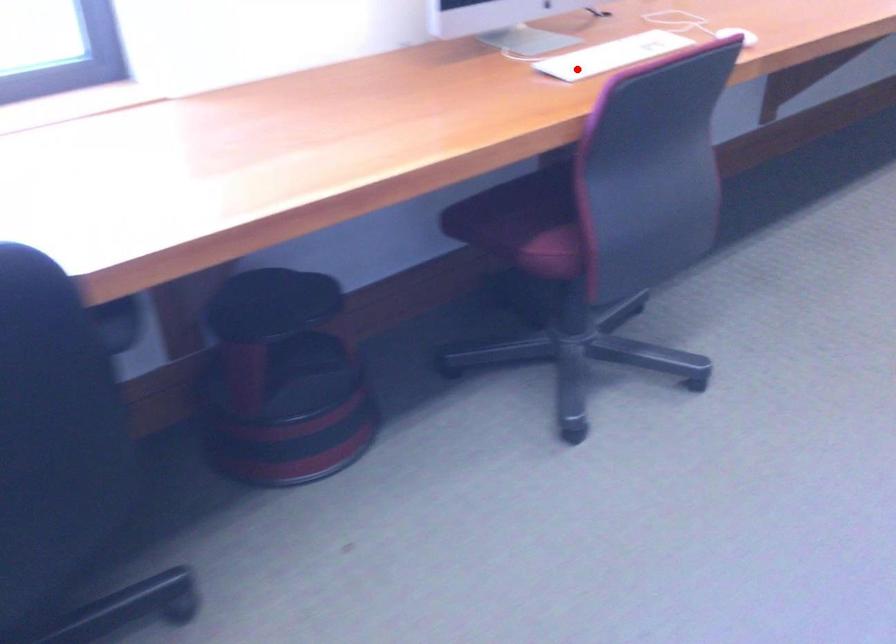
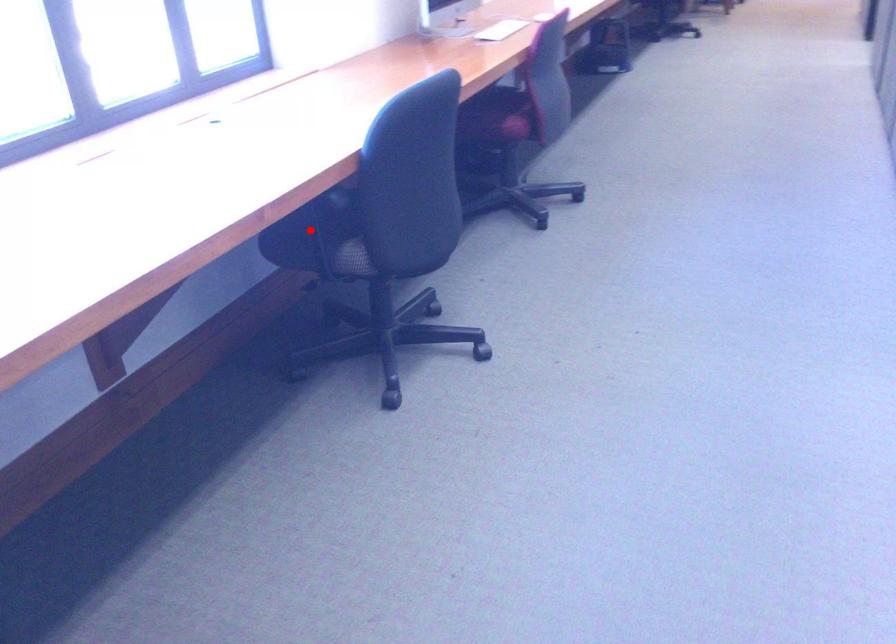
I am providing you with two images of the same scene from different viewpoints. A red point is marked on the first image and another point is marked on the second image. Is the marked point in image1 the same physical position as the marked point in image2?

No